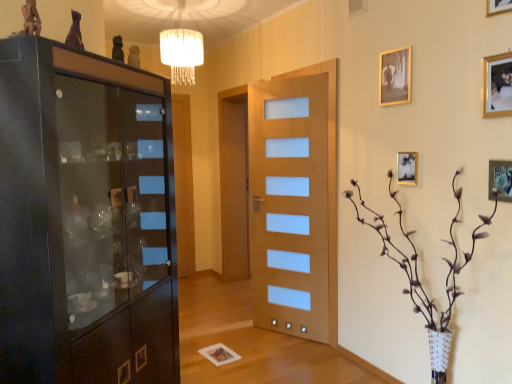
Question: Is matte black cabinet at left taller than matte gold picture frame at upper right, which appears as the 4th picture frame when ordered from the bottom?

Choices:
 (A) yes
 (B) no

Answer: (A)

Question: From a real-world perspective, does matte black cabinet at left sit lower than matte gold picture frame at upper right, which appears as the 4th picture frame when ordered from the bottom?

Choices:
 (A) no
 (B) yes

Answer: (B)

Question: Is matte black cabinet at left further to the viewer compared to matte gold picture frame at upper right, which appears as the 4th picture frame when ordered from the bottom?

Choices:
 (A) yes
 (B) no

Answer: (B)

Question: From a real-world perspective, is matte black cabinet at left on matte gold picture frame at upper right, which appears as the 4th picture frame when ordered from the bottom?

Choices:
 (A) no
 (B) yes

Answer: (A)

Question: Does matte black cabinet at left appear on the left side of matte gold picture frame at upper right, which appears as the 4th picture frame when ordered from the bottom?

Choices:
 (A) yes
 (B) no

Answer: (A)

Question: Would you say metallic gold picture frame at upper right, which ranks as the first picture frame in bottom-to-top order, is inside or outside wooden door with frosted glass panels at center?

Choices:
 (A) outside
 (B) inside

Answer: (A)

Question: From the image's perspective, is metallic gold picture frame at upper right, which ranks as the first picture frame in bottom-to-top order, positioned above or below wooden door with frosted glass panels at center?

Choices:
 (A) above
 (B) below

Answer: (A)

Question: From a real-world perspective, is metallic gold picture frame at upper right, which appears as the fifth picture frame when viewed from the top, physically located above or below wooden door with frosted glass panels at center?

Choices:
 (A) above
 (B) below

Answer: (A)

Question: Does point (507, 183) appear closer or farther from the camera than point (267, 299)?

Choices:
 (A) closer
 (B) farther

Answer: (A)

Question: Considering the positions of brown textured vase at right and metallic gold picture frame at upper right, which ranks as the first picture frame in bottom-to-top order, in the image, is brown textured vase at right wider or thinner than metallic gold picture frame at upper right, which ranks as the first picture frame in bottom-to-top order,?

Choices:
 (A) wide
 (B) thin

Answer: (A)

Question: Does point (416, 309) appear closer or farther from the camera than point (500, 165)?

Choices:
 (A) closer
 (B) farther

Answer: (B)

Question: Considering the positions of brown textured vase at right and metallic gold picture frame at upper right, which appears as the fifth picture frame when viewed from the top, in the image, is brown textured vase at right taller or shorter than metallic gold picture frame at upper right, which appears as the fifth picture frame when viewed from the top,?

Choices:
 (A) tall
 (B) short

Answer: (A)

Question: From the image's perspective, is brown textured vase at right above or below metallic gold picture frame at upper right, which appears as the fifth picture frame when viewed from the top?

Choices:
 (A) below
 (B) above

Answer: (A)

Question: Is wooden door with frosted glass panels at center inside the boundaries of gold metallic picture frame at upper right, the 3th picture frame positioned from the bottom, or outside?

Choices:
 (A) inside
 (B) outside

Answer: (B)

Question: Would you say wooden door with frosted glass panels at center is to the left or to the right of gold metallic picture frame at upper right, which appears as the 3th picture frame when viewed from the top, in the picture?

Choices:
 (A) right
 (B) left

Answer: (B)